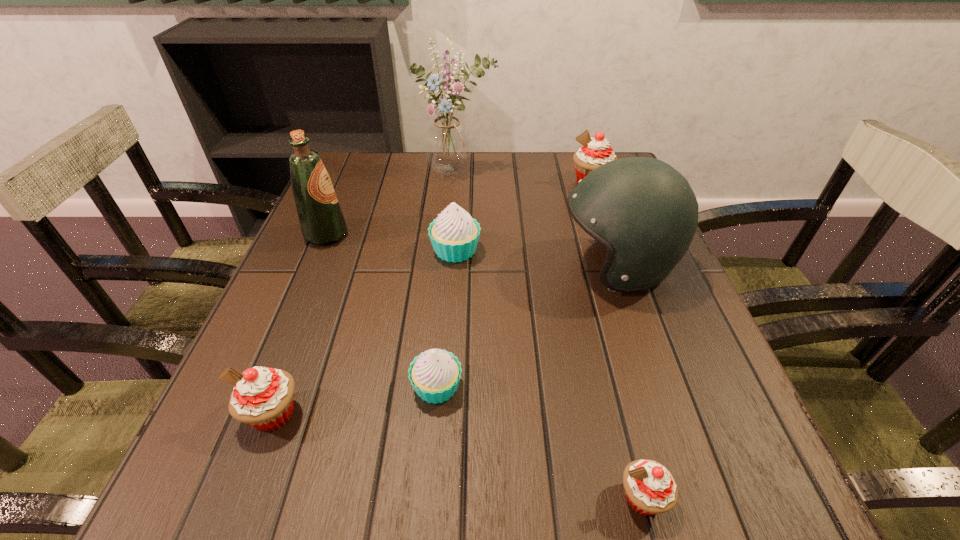
The height and width of the screenshot is (540, 960). What are the coordinates of `the tallest object` in the screenshot? It's located at (447, 142).

Where is `bouquet`? bouquet is located at coordinates (447, 142).

Image resolution: width=960 pixels, height=540 pixels. In order to click on green olive oil in this screenshot , I will do `click(321, 219)`.

What are the coordinates of `football helmet` in the screenshot? It's located at (645, 213).

I want to click on the biggest pink cupcake, so (x=595, y=151).

Image resolution: width=960 pixels, height=540 pixels. What are the coordinates of `the tallest cupcake` in the screenshot? It's located at (595, 151).

Locate an element on the screen. The width and height of the screenshot is (960, 540). the fourth nearest cupcake is located at coordinates (x=454, y=235).

At what (x,y) coordinates should I click in order to perform the action: click on the bigger white cupcake. Please return your answer as a coordinate pair (x, y). Looking at the image, I should click on (454, 235).

You are a GUI agent. You are given a task and a screenshot of the screen. Output one action in this format:
    pyautogui.click(x=<x>, y=<y>)
    Task: Click on the leftmost pink cupcake
    Image resolution: width=960 pixels, height=540 pixels.
    Given the screenshot: What is the action you would take?
    pyautogui.click(x=263, y=398)

Identify the location of the leftmost cupcake. The height and width of the screenshot is (540, 960). (263, 398).